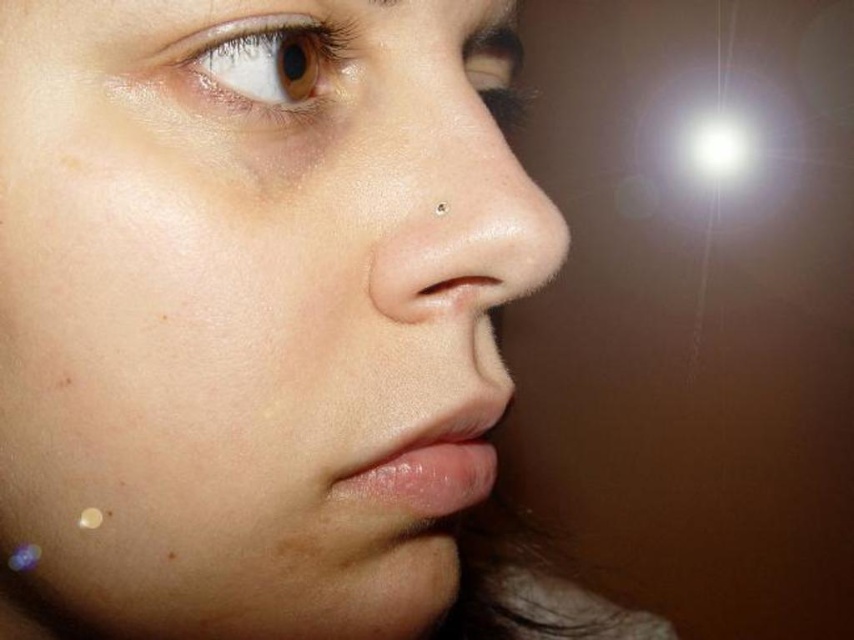
You are a photographer adjusting the focus of your camera. You have two points to focus on in the image, point 1 at point (268, 214) and point 2 at point (343, 81). Which point is closer to you?

Point 1 at point (268, 214) is closer to the viewer than point 2 at point (343, 81).

You are a photographer holding a camera and want to take a portrait of the smooth skin face at center. If the recommended distance for a close portrait is between 10 to 12 inches, is the current distance too close?

The smooth skin face at center and camera are 8.07 inches apart, which is below the recommended 10 to 12 inches range. Therefore, the current distance is too close.

You are a photographer adjusting lighting for a portrait. You need to ensure that the smooth skin face at center and the brown matte eye at upper left are both well lit. Given their sizes, which object requires a wider light source to cover its entire surface?

The smooth skin face at center requires a wider light source because its width surpasses that of the brown matte eye at upper left.